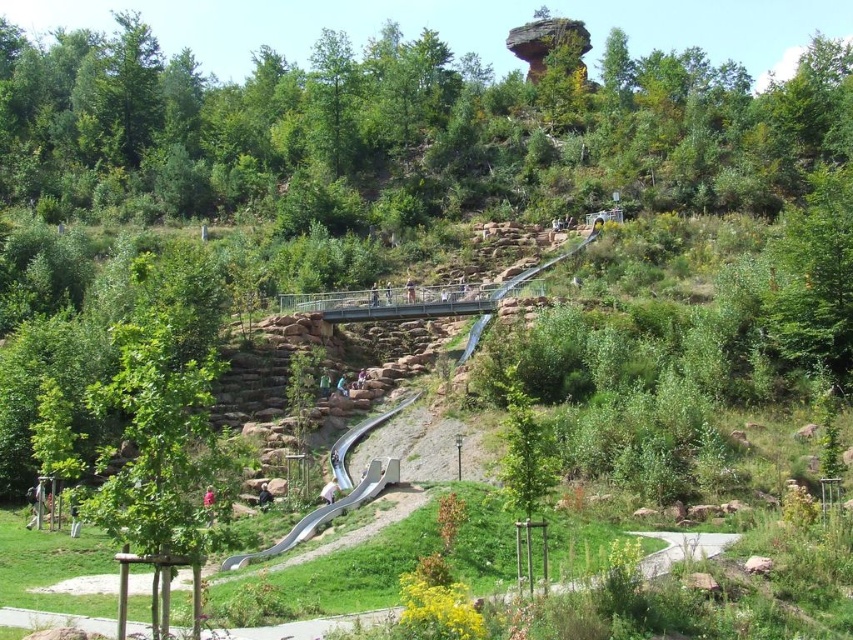
You are a parent trying to decide whether to let your child play on the smooth gray slide at lower center. You know that the green leafy tree at lower left is taller than the slide. Considering the slide is part of a climbing structure, would you worry about the slide being too high for a young child?

The green leafy tree at lower left is taller than the smooth gray slide at lower center. Since the slide is part of a climbing structure, its height is likely designed for safe play, but the tree being taller doesn

Looking at this image, you are a child trying to reach the smooth gray slide at lower center from the green leafy tree at lower left. Which direction should you move to get to the slide?

Since the green leafy tree at lower left is closer to you than the smooth gray slide at lower center, you should move forward towards the slide.

A child wants to throw a ball from the green leafy tree at lower left to the metal bridge in the middle. If the child can throw the ball 35 meters, will the ball reach the metal bridge?

The distance between the green leafy tree at lower left and the metal bridge in the middle is 33.82 meters. Since the child can throw the ball 35 meters, the ball will reach the metal bridge.